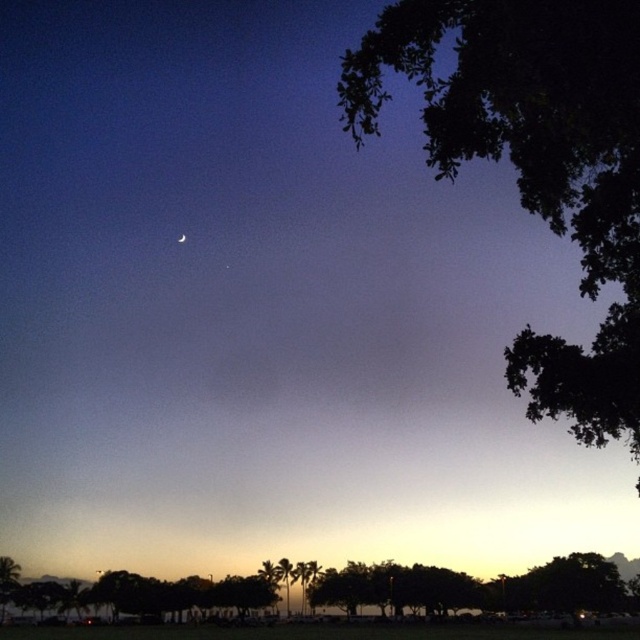
From the picture: Which is more to the left, green leafy tree at lower left or silver metallic crescent moon at upper center?

From the viewer's perspective, green leafy tree at lower left appears more on the left side.

Who is more forward, (4, 557) or (180, 234)?

Positioned in front is point (4, 557).

Where is `green leafy tree at lower left`? The height and width of the screenshot is (640, 640). green leafy tree at lower left is located at coordinates (8, 580).

Does dark green leafy tree at upper right have a smaller size compared to green leafy tree at lower center?

No, dark green leafy tree at upper right is not smaller than green leafy tree at lower center.

Who is higher up, dark green leafy tree at upper right or green leafy tree at lower center?

dark green leafy tree at upper right

The image size is (640, 640). I want to click on dark green leafy tree at upper right, so click(536, 161).

I want to click on dark green leafy tree at upper right, so click(536, 161).

Can you confirm if dark green leafy tree at upper right is thinner than silver metallic crescent moon at upper center?

No.

Measure the distance between dark green leafy tree at upper right and silver metallic crescent moon at upper center.

dark green leafy tree at upper right is 112.08 meters away from silver metallic crescent moon at upper center.

Locate an element on the screen. The width and height of the screenshot is (640, 640). dark green leafy tree at upper right is located at coordinates (536, 161).